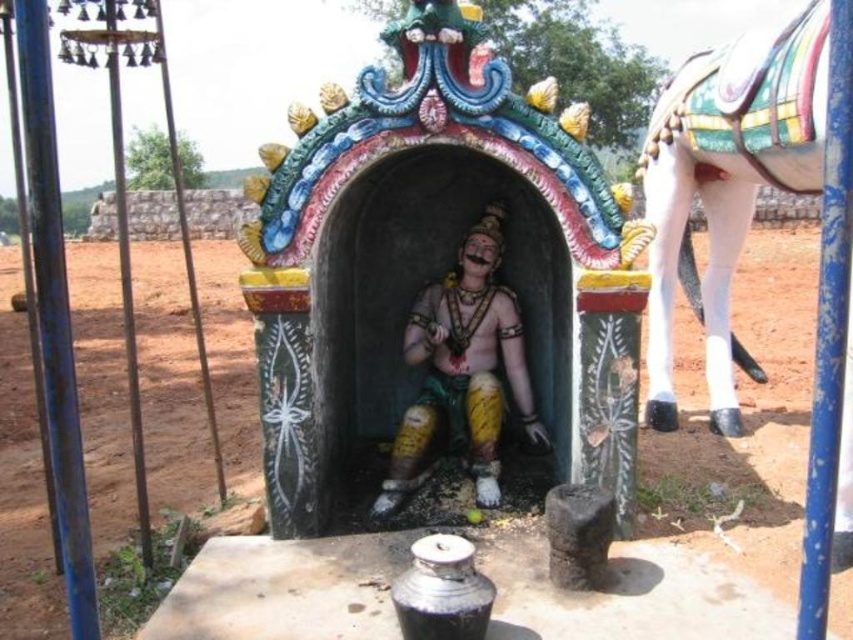
Question: Is white glossy horse at right closer to the viewer compared to polished bronze statue at center?

Choices:
 (A) yes
 (B) no

Answer: (A)

Question: Which of the following is the farthest from the observer?

Choices:
 (A) (650, 408)
 (B) (495, 378)

Answer: (A)

Question: Can you confirm if white glossy horse at right is smaller than polished bronze statue at center?

Choices:
 (A) yes
 (B) no

Answer: (B)

Question: Is white glossy horse at right below polished bronze statue at center?

Choices:
 (A) yes
 (B) no

Answer: (B)

Question: Among these objects, which one is farthest from the camera?

Choices:
 (A) polished bronze statue at center
 (B) white glossy horse at right

Answer: (A)